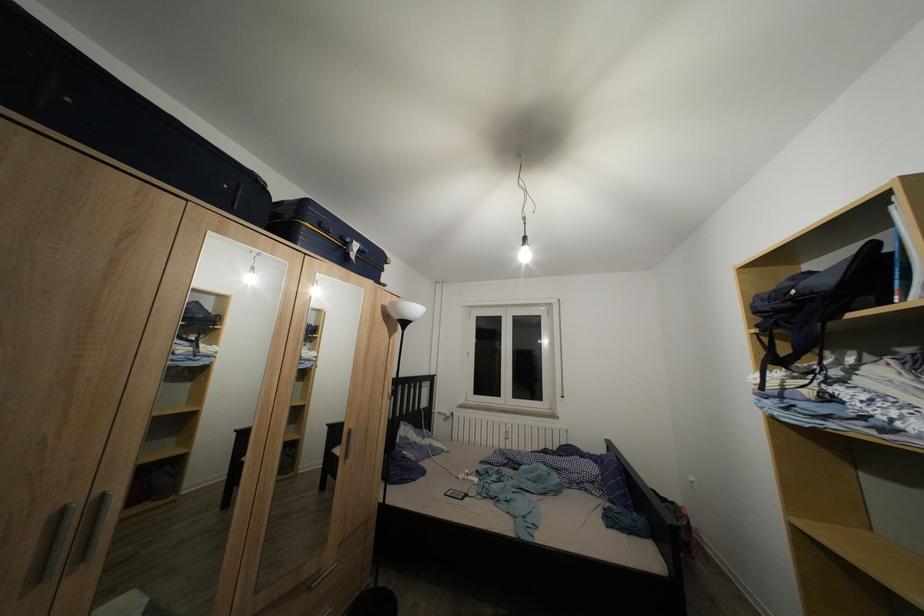
Find where to pull the silver drawer handle. Please return your answer as a coordinate pair (x, y).

(322, 576)